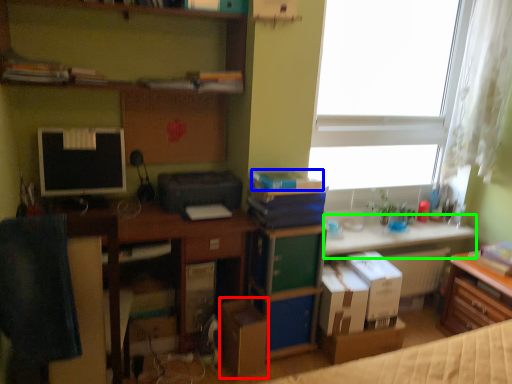
Question: Estimate the real-world distances between objects in this image. Which object is farther from cardboard box (highlighted by a red box), book (highlighted by a blue box) or table (highlighted by a green box)?

Choices:
 (A) book
 (B) table

Answer: (B)